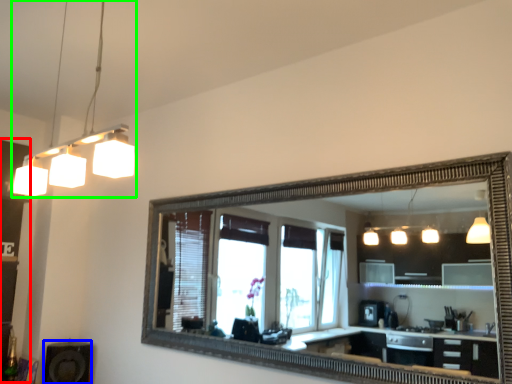
Question: Considering the real-world distances, which object is closest to dresser (highlighted by a red box)? speaker (highlighted by a blue box) or light fixture (highlighted by a green box).

Choices:
 (A) speaker
 (B) light fixture

Answer: (B)